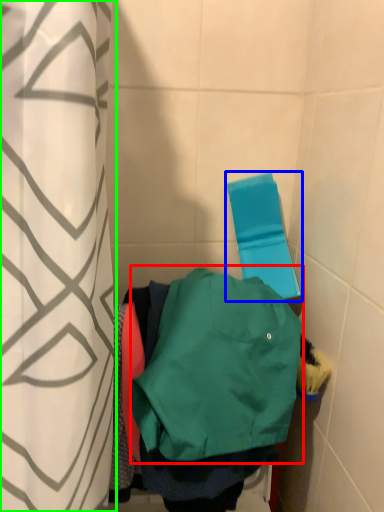
Question: Which object is the farthest from sweatshirt (highlighted by a red box)? Choose among these: beach towel (highlighted by a blue box) or curtain (highlighted by a green box).

Choices:
 (A) beach towel
 (B) curtain

Answer: (A)